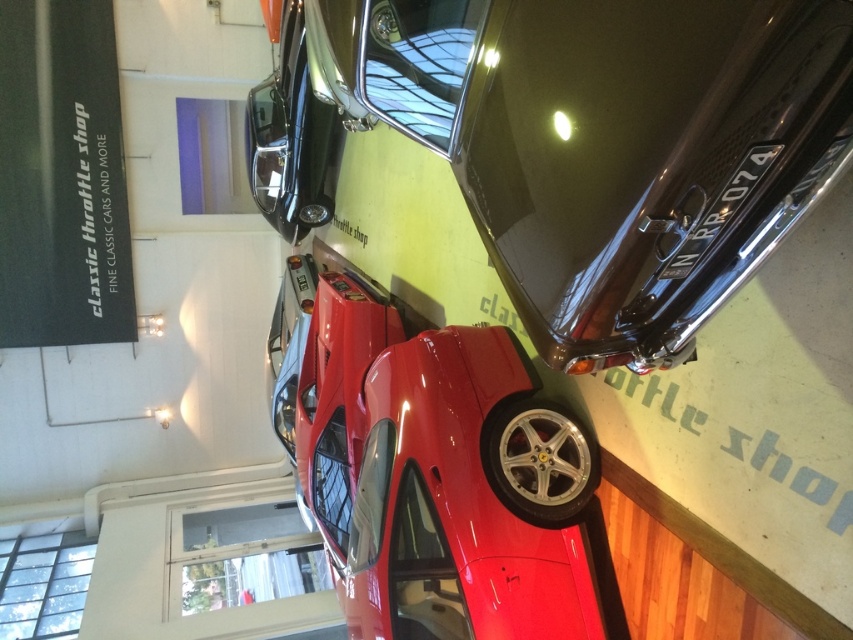
Question: Which of the following is the closest to the observer?

Choices:
 (A) (331, 531)
 (B) (601, 12)

Answer: (B)

Question: Considering the relative positions of shiny black car at upper center and glossy red car at center in the image provided, where is shiny black car at upper center located with respect to glossy red car at center?

Choices:
 (A) above
 (B) below

Answer: (A)

Question: Which of the following is the farthest from the observer?

Choices:
 (A) (608, 269)
 (B) (550, 502)

Answer: (B)

Question: Which point appears farthest from the camera in this image?

Choices:
 (A) tap(427, 364)
 (B) tap(436, 24)

Answer: (A)

Question: Is shiny black car at upper center bigger than glossy red car at center?

Choices:
 (A) no
 (B) yes

Answer: (A)

Question: Can you confirm if shiny black car at upper center is bigger than glossy red car at center?

Choices:
 (A) yes
 (B) no

Answer: (B)